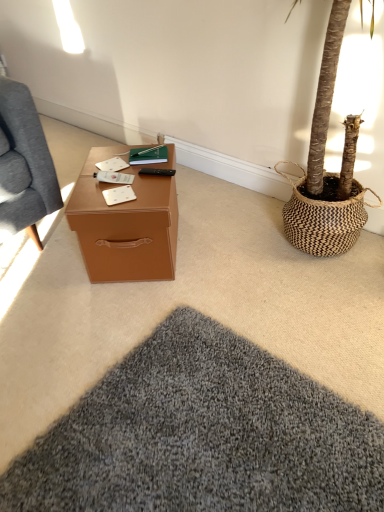
Question: From a real-world perspective, is brown leather desk at center physically located above or below soft gray carpet at center?

Choices:
 (A) below
 (B) above

Answer: (B)

Question: In the image, is brown leather desk at center positioned in front of or behind soft gray carpet at center?

Choices:
 (A) behind
 (B) front

Answer: (A)

Question: Which object is positioned closest to the soft gray carpet at center?

Choices:
 (A) black matte remote control at center
 (B) hardcover book at center
 (C) brown leather desk at center
 (D) white matte notepad at center

Answer: (C)

Question: Which is nearer to the soft gray carpet at center?

Choices:
 (A) brown leather desk at center
 (B) black matte remote control at center
 (C) hardcover book at center
 (D) white matte notepad at center

Answer: (A)